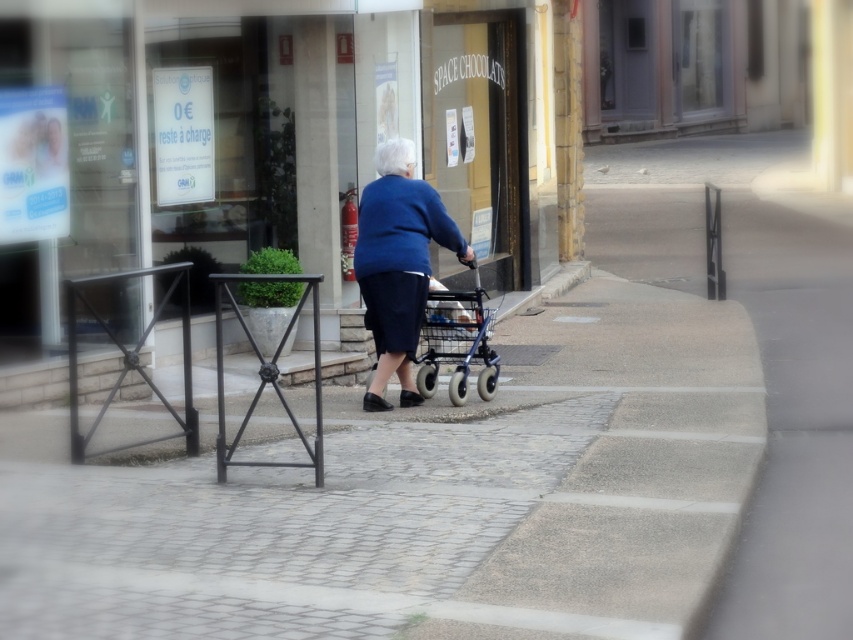
You are a delivery person trying to navigate a narrow sidewalk. You see the gray concrete pavement at center and the blue fabric walker at center. Which object has a larger area?

The gray concrete pavement at center is bigger than the blue fabric walker at center, so the gray concrete pavement at center has a larger area.